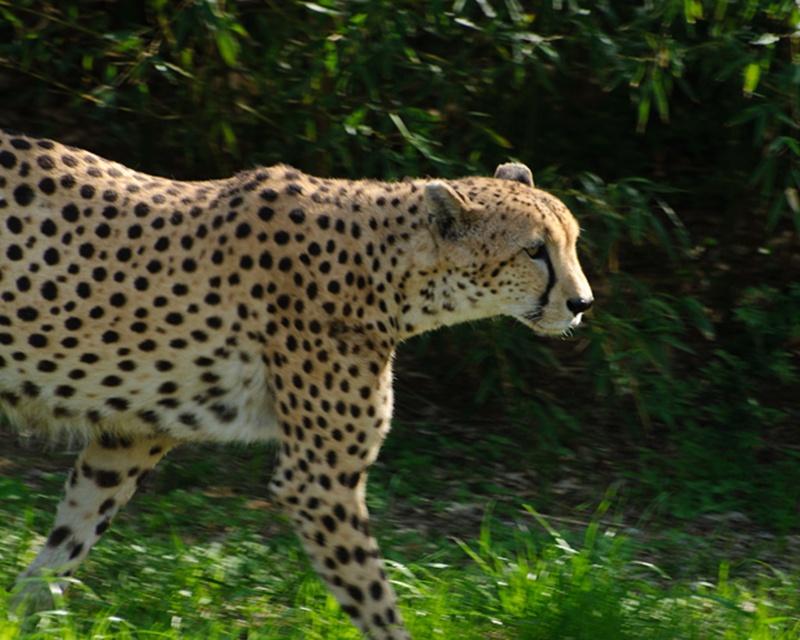
You are a wildlife photographer observing the scene. You notice the spotted fur cheetah at center and the green grass at lower center. Which object is located higher in the image?

The spotted fur cheetah at center is positioned over green grass at lower center, so the spotted fur cheetah at center is higher in the image.

You are a wildlife photographer observing the scene. You want to capture a photo where the spotted fur cheetah at center is positioned to the right of the green grass at lower center. Based on the current arrangement, is this possible without moving any objects?

The spotted fur cheetah at center is currently to the left of green grass at lower center, so it is not possible to position the spotted fur cheetah at center to the right of the green grass at lower center without moving any objects.